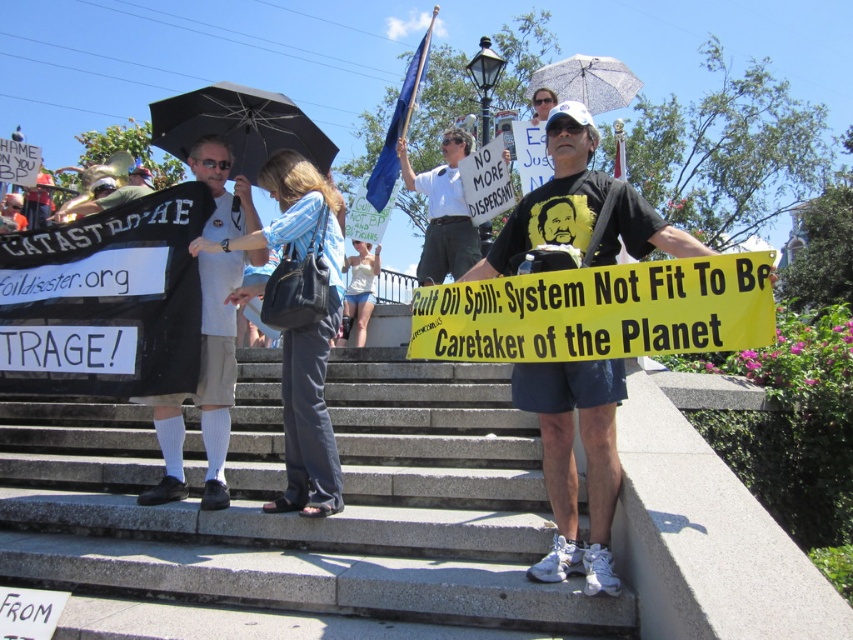
Question: Does black t-shirt at center have a greater width compared to transparent floral-patterned umbrella at upper center?

Choices:
 (A) no
 (B) yes

Answer: (A)

Question: Does black t-shirt at center have a greater width compared to white paper sign at center?

Choices:
 (A) yes
 (B) no

Answer: (A)

Question: Which of the following is the farthest from the observer?

Choices:
 (A) white paper sign at center
 (B) black fabric umbrella at upper center

Answer: (A)

Question: Which object appears farthest from the camera in this image?

Choices:
 (A) white paper sign at center
 (B) black t-shirt at center

Answer: (A)

Question: Which object appears farthest from the camera in this image?

Choices:
 (A) transparent floral-patterned umbrella at upper center
 (B) white paper sign at center
 (C) black fabric umbrella at upper center

Answer: (A)

Question: Where is black fabric umbrella at upper center located in relation to transparent floral-patterned umbrella at upper center in the image?

Choices:
 (A) above
 (B) below

Answer: (B)